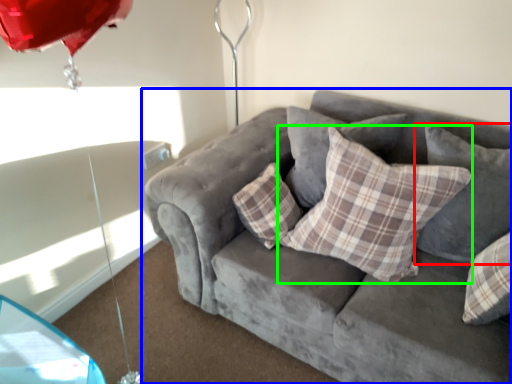
Question: Which object is positioned farthest from pillow (highlighted by a red box)? Select from studio couch (highlighted by a blue box) and pillow (highlighted by a green box).

Choices:
 (A) studio couch
 (B) pillow

Answer: (A)